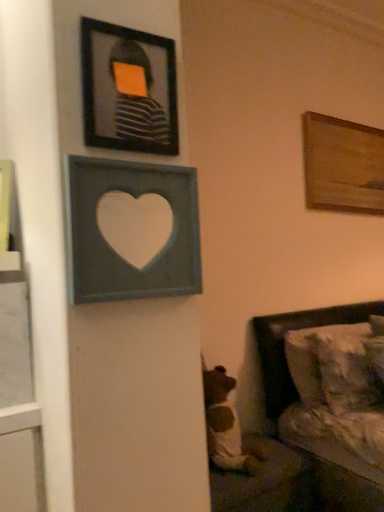
Question: Is wooden painting at upper right, the third picture frame from the left, facing towards white textured pillow at lower right?

Choices:
 (A) no
 (B) yes

Answer: (A)

Question: Is wooden painting at upper right, which is counted as the 3th picture frame, starting from the front, positioned behind white textured pillow at lower right?

Choices:
 (A) yes
 (B) no

Answer: (A)

Question: Is wooden painting at upper right, the third picture frame from the left, outside of white textured pillow at lower right?

Choices:
 (A) yes
 (B) no

Answer: (A)

Question: Is wooden painting at upper right, which is counted as the 3th picture frame, starting from the front, bigger than white textured pillow at lower right?

Choices:
 (A) yes
 (B) no

Answer: (B)

Question: Can you confirm if wooden painting at upper right, the third picture frame from the left, is shorter than white textured pillow at lower right?

Choices:
 (A) yes
 (B) no

Answer: (B)

Question: Does wooden painting at upper right, which appears as the first picture frame when viewed from the right, have a smaller size compared to white textured pillow at lower right?

Choices:
 (A) no
 (B) yes

Answer: (B)

Question: From the image's perspective, is white textured pillow at lower right on top of brown plush bear at lower center?

Choices:
 (A) no
 (B) yes

Answer: (B)

Question: Is white textured pillow at lower right located outside brown plush bear at lower center?

Choices:
 (A) yes
 (B) no

Answer: (A)

Question: Can you confirm if white textured pillow at lower right is bigger than brown plush bear at lower center?

Choices:
 (A) yes
 (B) no

Answer: (A)

Question: Is white textured pillow at lower right positioned in front of brown plush bear at lower center?

Choices:
 (A) yes
 (B) no

Answer: (B)

Question: Is brown plush bear at lower center surrounded by white textured pillow at lower right?

Choices:
 (A) yes
 (B) no

Answer: (B)

Question: Does white textured pillow at lower right appear on the left side of brown plush bear at lower center?

Choices:
 (A) yes
 (B) no

Answer: (B)

Question: Considering the relative sizes of gray wood heart at upper center, the second picture frame viewed from the left, and brown plush bear at lower center in the image provided, is gray wood heart at upper center, the second picture frame viewed from the left, shorter than brown plush bear at lower center?

Choices:
 (A) no
 (B) yes

Answer: (B)